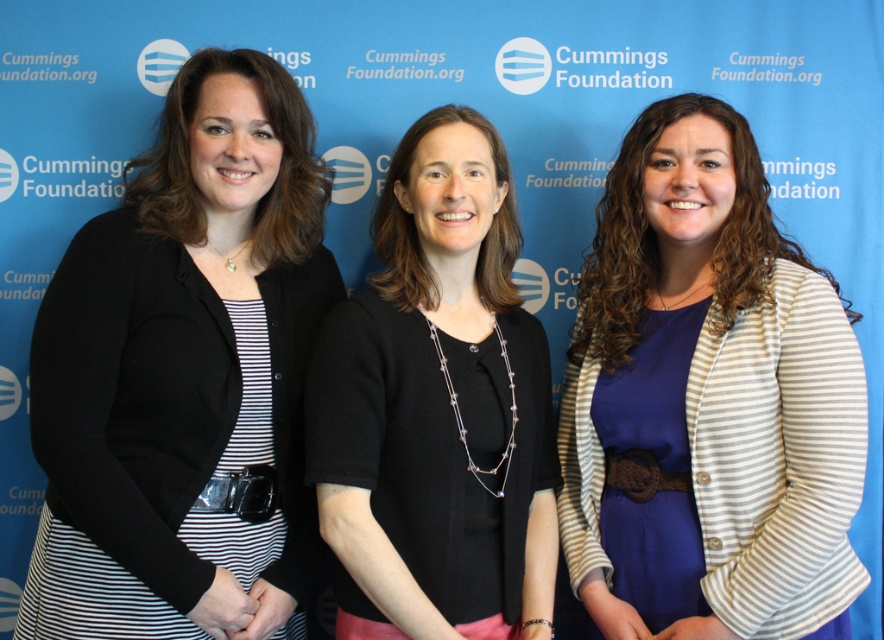
You are observing the three women in the image. Which clothing item, the black matte blazer at left or the black matte sweater at center, is positioned higher on their respective bodies?

The black matte blazer at left is located above the black matte sweater at center, meaning it is positioned higher on the body.

Based on the scene description, where is the striped fabric dress at center located in the image?

The striped fabric dress at center is located at point (706, 397) in the image.